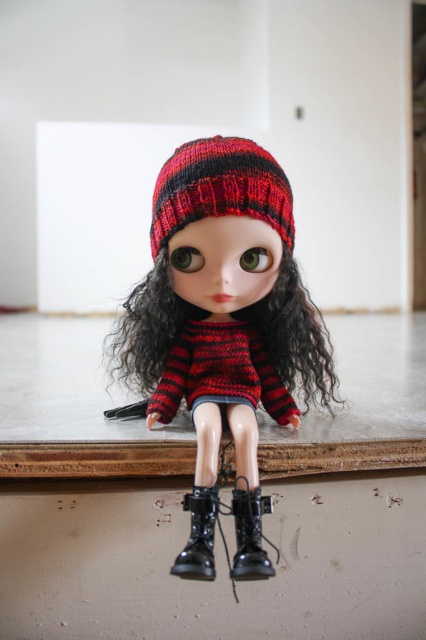
Question: Can you confirm if black leather boots at lower center is bigger than black leather boot at lower center?

Choices:
 (A) yes
 (B) no

Answer: (A)

Question: Is knitted woolen hat at center thinner than black leather boots at lower center?

Choices:
 (A) no
 (B) yes

Answer: (A)

Question: Among these points, which one is farthest from the camera?

Choices:
 (A) (198, 570)
 (B) (244, 275)

Answer: (B)

Question: Can you confirm if knitted woolen beanie at center is positioned to the right of black leather boot at lower center?

Choices:
 (A) yes
 (B) no

Answer: (A)

Question: Estimate the real-world distances between objects in this image. Which object is farther from the knitted woolen hat at center?

Choices:
 (A) black leather boot at lower center
 (B) knitted red and black sweater at center

Answer: (A)

Question: Which point is closer to the camera taking this photo?

Choices:
 (A) (252, 528)
 (B) (163, 182)
 (C) (204, 170)
 (D) (218, 500)

Answer: (A)